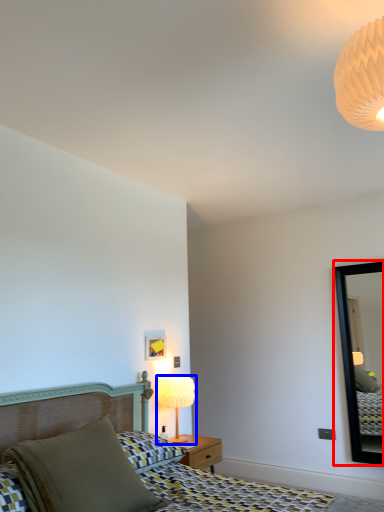
Question: Among these objects, which one is nearest to the camera, mirror (highlighted by a red box) or table lamp (highlighted by a blue box)?

Choices:
 (A) mirror
 (B) table lamp

Answer: (B)